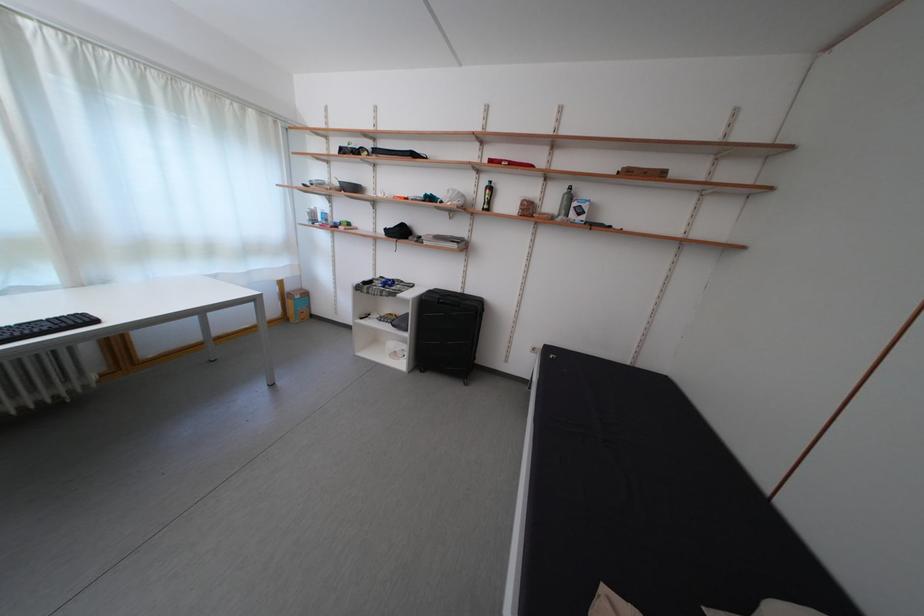
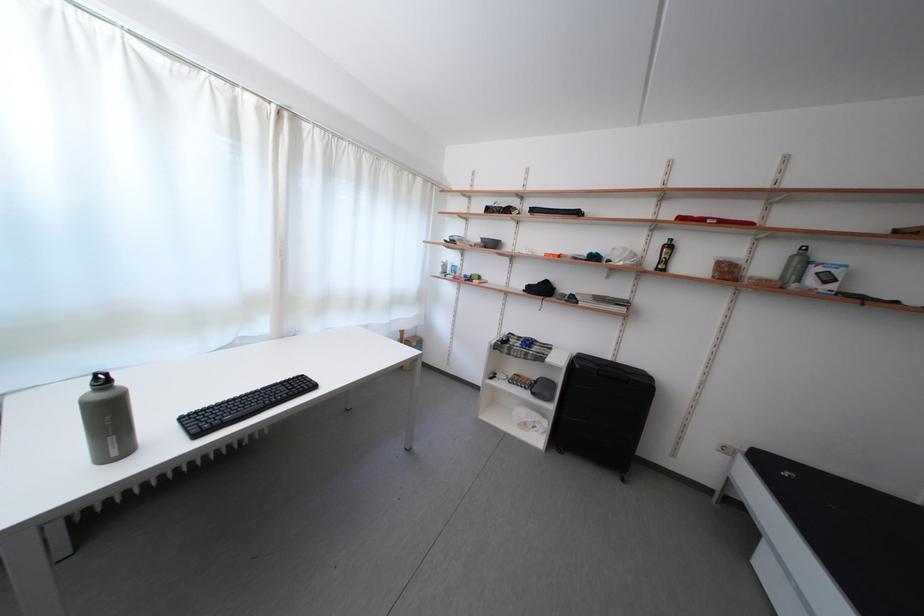
Find the pixel in the second image that matches (538,216) in the first image.

(736, 278)